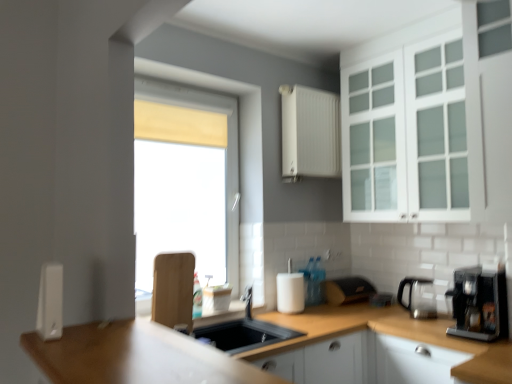
What is the approximate width of matte yellow curtain at center?

It is 6.32 inches.

Describe the element at coordinates (310, 132) in the screenshot. I see `white matte cabinet at upper center, marked as the 1th cabinetry in a top-to-bottom arrangement` at that location.

Measure the distance between point [458,110] and camera.

A distance of 7.92 feet exists between point [458,110] and camera.

Locate an element on the screen. black plastic coffee machine at right, placed as the 2th coffee machine when sorted from back to front is located at coordinates (480, 304).

Locate an element on the screen. This screenshot has height=384, width=512. satin silver coffee machine at right, the 1th coffee machine from the back is located at coordinates (418, 297).

In order to face satin silver coffee machine at right, acting as the 2th coffee machine starting from the front, should I rotate leftwards or rightwards?

Rotate your view right by about 20.660°.

What is the approximate width of white plastic soap dispenser at left, which ranks as the first appliance in left-to-right order?

white plastic soap dispenser at left, which ranks as the first appliance in left-to-right order, is 4.05 inches in width.

How much space does white matte cabinet at lower right, positioned as the 1th cabinetry in bottom-to-top order, occupy horizontally?

The width of white matte cabinet at lower right, positioned as the 1th cabinetry in bottom-to-top order, is 4.25 feet.

The width and height of the screenshot is (512, 384). I want to click on matte yellow curtain at center, so click(186, 180).

From a real-world perspective, between white plastic soap dispenser at left, which is counted as the 2th appliance, starting from the right, and matte yellow curtain at center, who is vertically lower?

white plastic soap dispenser at left, which is counted as the 2th appliance, starting from the right, from a real-world perspective.

Between white plastic soap dispenser at left, which is the second appliance in bottom-to-top order, and matte yellow curtain at center, which one has more height?

matte yellow curtain at center.

In the image, there is a white plastic soap dispenser at left, which is the second appliance in bottom-to-top order. Identify the location of window above it (from the image's perspective). This screenshot has height=384, width=512. (186, 180).

From the image's perspective, relative to matte yellow curtain at center, is white plastic soap dispenser at left, the first appliance viewed from the front, above or below?

From the image's perspective, white plastic soap dispenser at left, the first appliance viewed from the front, appears below matte yellow curtain at center.

Is matte black toaster at center, marked as the first appliance in a back-to-front arrangement, inside white matte cabinet at lower right, positioned as the 1th cabinetry in bottom-to-top order?

Actually, matte black toaster at center, marked as the first appliance in a back-to-front arrangement, is outside white matte cabinet at lower right, positioned as the 1th cabinetry in bottom-to-top order.

Considering the relative positions of white matte cabinet at lower right, the 3th cabinetry from the top, and matte black toaster at center, which is the second appliance from top to bottom, in the image provided, is white matte cabinet at lower right, the 3th cabinetry from the top, to the left or to the right of matte black toaster at center, which is the second appliance from top to bottom,?

Based on their positions, white matte cabinet at lower right, the 3th cabinetry from the top, is located to the right of matte black toaster at center, which is the second appliance from top to bottom.

Considering the points (411, 367) and (356, 283), which point is in front, point (411, 367) or point (356, 283)?

The point (411, 367) is more forward.

Between white matte cabinet at lower right, positioned as the 1th cabinetry in bottom-to-top order, and matte black toaster at center, the first appliance ordered from the bottom, which one has less height?

With less height is matte black toaster at center, the first appliance ordered from the bottom.

Is white matte cabinet at lower right, positioned as the 1th cabinetry in bottom-to-top order, thinner than black plastic coffee machine at right, which ranks as the 1th coffee machine in front-to-back order?

No.

Does point (291, 371) appear closer or farther from the camera than point (454, 283)?

Point (291, 371).

From the image's perspective, is white matte cabinet at lower right, the 3th cabinetry from the top, beneath black plastic coffee machine at right, which ranks as the 1th coffee machine in front-to-back order?

Indeed, from the image's perspective, white matte cabinet at lower right, the 3th cabinetry from the top, is shown beneath black plastic coffee machine at right, which ranks as the 1th coffee machine in front-to-back order.

Locate an element on the screen. The image size is (512, 384). window behind the white glass cabinet at upper right, the second cabinetry positioned from the bottom is located at coordinates click(x=186, y=180).

Between matte yellow curtain at center and white glass cabinet at upper right, which appears as the 2th cabinetry when viewed from the top, which one is positioned in front?

white glass cabinet at upper right, which appears as the 2th cabinetry when viewed from the top, is in front.

Does matte yellow curtain at center have a smaller size compared to white glass cabinet at upper right, the second cabinetry positioned from the bottom?

Yes, matte yellow curtain at center is smaller than white glass cabinet at upper right, the second cabinetry positioned from the bottom.

Between matte yellow curtain at center and white glass cabinet at upper right, which appears as the 2th cabinetry when viewed from the top, which one has more height?

matte yellow curtain at center is taller.

From a real-world perspective, which cabinetry is the 1st one above the white matte cabinet at lower right, the 3th cabinetry from the top? Please provide its 2D coordinates.

[(430, 122)]

Which object is positioned more to the right, white matte cabinet at lower right, the 3th cabinetry from the top, or white glass cabinet at upper right, the second cabinetry positioned from the bottom?

white glass cabinet at upper right, the second cabinetry positioned from the bottom.

Considering the sizes of white matte cabinet at lower right, positioned as the 1th cabinetry in bottom-to-top order, and white glass cabinet at upper right, the second cabinetry positioned from the bottom, in the image, is white matte cabinet at lower right, positioned as the 1th cabinetry in bottom-to-top order, taller or shorter than white glass cabinet at upper right, the second cabinetry positioned from the bottom,?

Considering their sizes, white matte cabinet at lower right, positioned as the 1th cabinetry in bottom-to-top order, has less height than white glass cabinet at upper right, the second cabinetry positioned from the bottom.

Which of these two, white matte cabinet at lower right, the 3th cabinetry from the top, or white glass cabinet at upper right, which appears as the 2th cabinetry when viewed from the top, is bigger?

With larger size is white glass cabinet at upper right, which appears as the 2th cabinetry when viewed from the top.

Is point (499, 116) more distant than point (287, 176)?

No.

In terms of height, does white glass cabinet at upper right, the second cabinetry positioned from the bottom, look taller or shorter compared to white matte cabinet at upper center, marked as the 1th cabinetry in a top-to-bottom arrangement?

Clearly, white glass cabinet at upper right, the second cabinetry positioned from the bottom, is taller compared to white matte cabinet at upper center, marked as the 1th cabinetry in a top-to-bottom arrangement.

Does white glass cabinet at upper right, which appears as the 2th cabinetry when viewed from the top, have a lesser width compared to white matte cabinet at upper center, marked as the 1th cabinetry in a top-to-bottom arrangement?

Incorrect, the width of white glass cabinet at upper right, which appears as the 2th cabinetry when viewed from the top, is not less than that of white matte cabinet at upper center, marked as the 1th cabinetry in a top-to-bottom arrangement.

From a real-world perspective, between white glass cabinet at upper right, which appears as the 2th cabinetry when viewed from the top, and white matte cabinet at upper center, marked as the 1th cabinetry in a top-to-bottom arrangement, who is vertically lower?

From a 3D spatial view, white glass cabinet at upper right, which appears as the 2th cabinetry when viewed from the top, is below.

From the image's perspective, which object appears higher, matte black toaster at center, the 2th appliance from the left, or black plastic coffee machine at right, which ranks as the 1th coffee machine in front-to-back order?

black plastic coffee machine at right, which ranks as the 1th coffee machine in front-to-back order, from the image's perspective.

Looking at this image, is matte black toaster at center, which is the first appliance from right to left, oriented away from black plastic coffee machine at right, placed as the 2th coffee machine when sorted from back to front?

That's not correct — matte black toaster at center, which is the first appliance from right to left, is not looking away from black plastic coffee machine at right, placed as the 2th coffee machine when sorted from back to front.

Considering the relative sizes of matte black toaster at center, the first appliance ordered from the bottom, and black plastic coffee machine at right, placed as the 2th coffee machine when sorted from back to front, in the image provided, is matte black toaster at center, the first appliance ordered from the bottom, taller than black plastic coffee machine at right, placed as the 2th coffee machine when sorted from back to front,?

Incorrect, the height of matte black toaster at center, the first appliance ordered from the bottom, is not larger of that of black plastic coffee machine at right, placed as the 2th coffee machine when sorted from back to front.

From the image's perspective, count 1st appliances downward from the matte yellow curtain at center and point to it. Please provide its 2D coordinates.

[(50, 302)]

The height and width of the screenshot is (384, 512). I want to click on cabinetry below the matte black toaster at center, which appears as the 2th appliance when viewed from the front (from a real-world perspective), so click(365, 361).

When comparing their distances from white plastic soap dispenser at left, which is counted as the 2th appliance, starting from the right, does matte black toaster at center, which appears as the 2th appliance when viewed from the front, or black plastic coffee machine at right, placed as the 2th coffee machine when sorted from back to front, seem further?

matte black toaster at center, which appears as the 2th appliance when viewed from the front, lies further to white plastic soap dispenser at left, which is counted as the 2th appliance, starting from the right, than the other object.

Looking at the image, which one is located further to white matte cabinet at upper center, which is counted as the third cabinetry, starting from the bottom, matte black toaster at center, marked as the first appliance in a back-to-front arrangement, or white matte cabinet at lower right, the 3th cabinetry from the top?

Among the two, white matte cabinet at lower right, the 3th cabinetry from the top, is located further to white matte cabinet at upper center, which is counted as the third cabinetry, starting from the bottom.

Based on the photo, from the image, which object appears to be farther from matte yellow curtain at center, satin silver coffee machine at right, the 1th coffee machine from the back, or white plastic soap dispenser at left, which is the second appliance in bottom-to-top order?

white plastic soap dispenser at left, which is the second appliance in bottom-to-top order, is positioned further to the anchor matte yellow curtain at center.

Considering their positions, is white glass cabinet at upper right, which appears as the 2th cabinetry when viewed from the top, positioned further to matte black toaster at center, which appears as the 2th appliance when viewed from the front, than white matte cabinet at upper center, which is counted as the third cabinetry, starting from the bottom?

Based on the image, white glass cabinet at upper right, which appears as the 2th cabinetry when viewed from the top, appears to be further to matte black toaster at center, which appears as the 2th appliance when viewed from the front.

Based on their spatial positions, is white matte cabinet at upper center, which is counted as the third cabinetry, starting from the bottom, or matte black toaster at center, the 2th appliance from the left, closer to satin silver coffee machine at right, acting as the 2th coffee machine starting from the front?

Based on the image, matte black toaster at center, the 2th appliance from the left, appears to be nearer to satin silver coffee machine at right, acting as the 2th coffee machine starting from the front.

Estimate the real-world distances between objects in this image. Which object is closer to white matte cabinet at lower right, positioned as the 1th cabinetry in bottom-to-top order, matte yellow curtain at center or white plastic soap dispenser at left, which is the second appliance in bottom-to-top order?

white plastic soap dispenser at left, which is the second appliance in bottom-to-top order.

Considering their positions, is white matte cabinet at upper center, which is counted as the third cabinetry, starting from the bottom, positioned further to black plastic coffee machine at right, placed as the 2th coffee machine when sorted from back to front, than matte yellow curtain at center?

Among the two, matte yellow curtain at center is located further to black plastic coffee machine at right, placed as the 2th coffee machine when sorted from back to front.

Estimate the real-world distances between objects in this image. Which object is further from black plastic coffee machine at right, placed as the 2th coffee machine when sorted from back to front, white plastic soap dispenser at left, the 1th appliance when ordered from top to bottom, or white matte cabinet at lower right, positioned as the 1th cabinetry in bottom-to-top order?

white plastic soap dispenser at left, the 1th appliance when ordered from top to bottom, is positioned further to the anchor black plastic coffee machine at right, placed as the 2th coffee machine when sorted from back to front.

At what (x,y) coordinates should I click in order to perform the action: click on appliance situated between matte yellow curtain at center and satin silver coffee machine at right, the 1th coffee machine from the back, from left to right. Please return your answer as a coordinate pair (x, y). Looking at the image, I should click on (347, 290).

Find the location of a particular element. The height and width of the screenshot is (384, 512). window between white plastic soap dispenser at left, which is the second appliance in bottom-to-top order, and white glass cabinet at upper right, the second cabinetry positioned from the bottom, in the horizontal direction is located at coordinates (186, 180).

Locate an element on the screen. Image resolution: width=512 pixels, height=384 pixels. window between white plastic soap dispenser at left, which is counted as the 2th appliance, starting from the right, and white matte cabinet at upper center, which is counted as the third cabinetry, starting from the bottom, in the front-back direction is located at coordinates (186, 180).

Locate an element on the screen. window situated between white plastic soap dispenser at left, which is counted as the 2th appliance, starting from the right, and black plastic coffee machine at right, placed as the 2th coffee machine when sorted from back to front, from left to right is located at coordinates (186, 180).